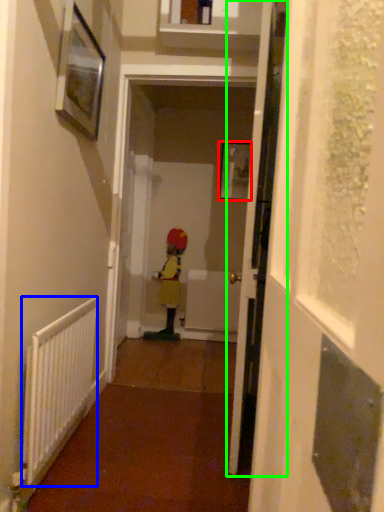
Question: Estimate the real-world distances between objects in this image. Which object is closer to picture frame (highlighted by a red box), radiator (highlighted by a blue box) or door (highlighted by a green box)?

Choices:
 (A) radiator
 (B) door

Answer: (B)